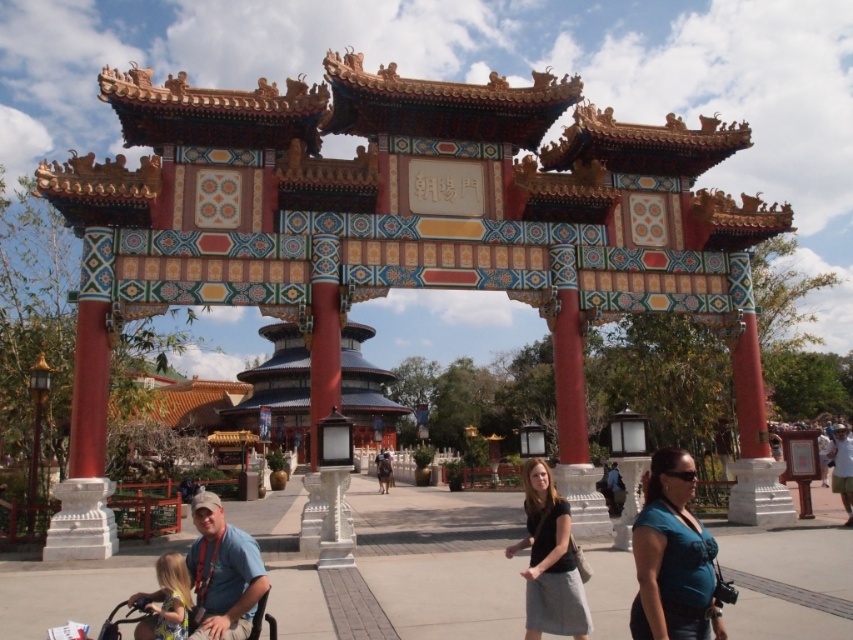
Does black cotton shirt at center appear on the left side of light brown leather jacket at lower right?

Indeed, black cotton shirt at center is positioned on the left side of light brown leather jacket at lower right.

You are a GUI agent. You are given a task and a screenshot of the screen. Output one action in this format:
    pyautogui.click(x=<x>, y=<y>)
    Task: Click on the black cotton shirt at center
    The width and height of the screenshot is (853, 640).
    Given the screenshot: What is the action you would take?
    click(549, 561)

This screenshot has width=853, height=640. What are the coordinates of `black cotton shirt at center` in the screenshot? It's located at (549, 561).

Is light brown leather jacket at lower right taller than dark blue shirt at center?

Yes, light brown leather jacket at lower right is taller than dark blue shirt at center.

From the picture: Can you confirm if light brown leather jacket at lower right is positioned below dark blue shirt at center?

Actually, light brown leather jacket at lower right is above dark blue shirt at center.

What do you see at coordinates (842, 467) in the screenshot? Image resolution: width=853 pixels, height=640 pixels. I see `light brown leather jacket at lower right` at bounding box center [842, 467].

Locate an element on the screen. The height and width of the screenshot is (640, 853). light brown leather jacket at lower right is located at coordinates (842, 467).

Is black cotton shirt at center above dark blue shirt at center?

Indeed, black cotton shirt at center is positioned over dark blue shirt at center.

The image size is (853, 640). Find the location of `black cotton shirt at center`. black cotton shirt at center is located at coordinates (549, 561).